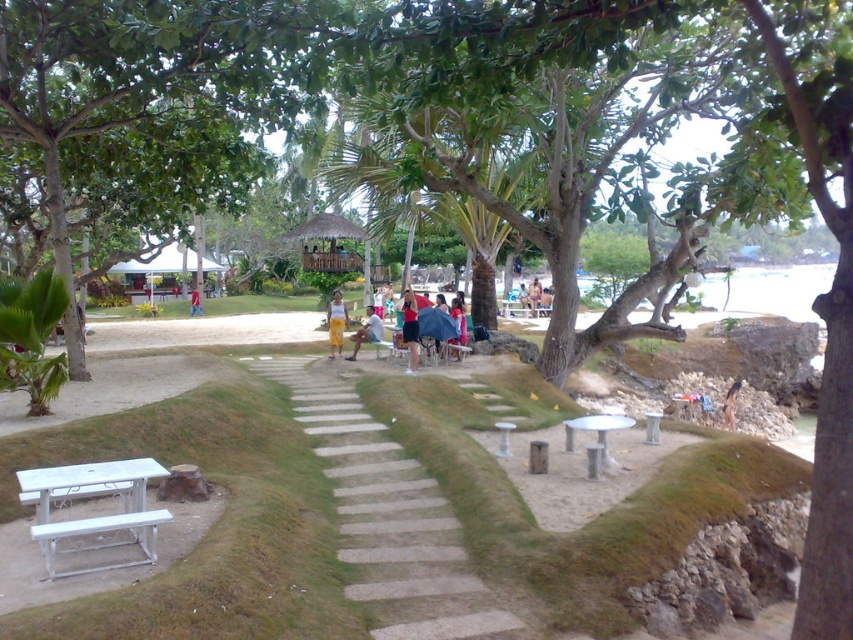
You are planning to set up a shaded area for a beach event. You have a white fabric umbrella at center and a dark blue fabric bikini at lower right in the scene. Which object can provide shade for the bikini?

The white fabric umbrella at center is above the dark blue fabric bikini at lower right, so it can provide shade for the bikini.

You are planning to take a photo of the white fabric umbrella at center and the dark blue fabric bikini at lower right. Since you want both subjects to be clearly visible, which object should you focus on first when adjusting your camera settings?

You should focus on the white fabric umbrella at center first because it is in front of the dark blue fabric bikini at lower right, ensuring it will be in sharp focus while the background subject may appear slightly blurred.

You are a photographer trying to capture a photo of the light gray concrete steps at center and the dark blue fabric bikini at lower right. Which object should you focus on first if you want to ensure both are in focus without adjusting your camera settings?

The light gray concrete steps at center is much taller than the dark blue fabric bikini at lower right, so you should focus on the light gray concrete steps at center first to ensure both are in focus.